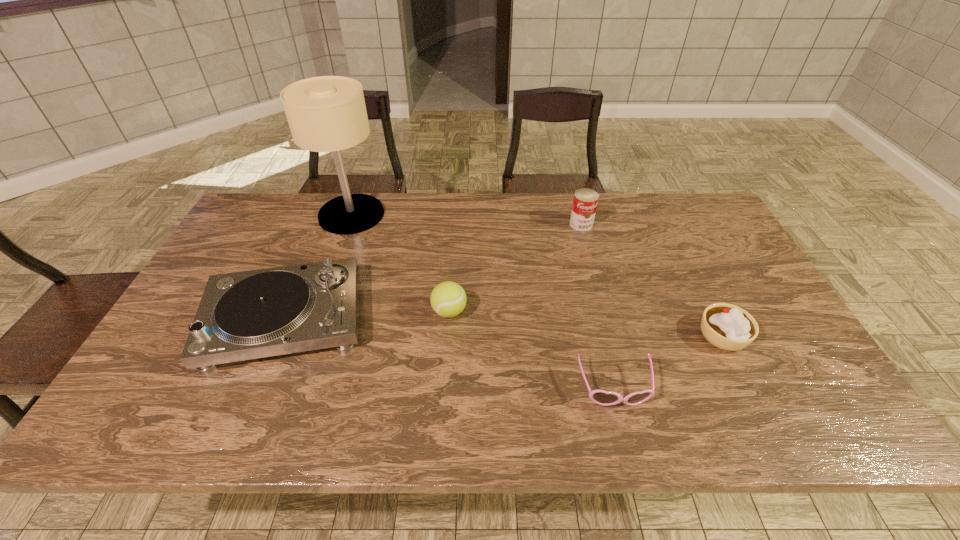
Locate an element on the screen. The image size is (960, 540). free space located on the front of the rightmost object is located at coordinates (756, 400).

Locate an element on the screen. This screenshot has width=960, height=540. table lamp that is at the far edge is located at coordinates tap(326, 113).

At what (x,y) coordinates should I click in order to perform the action: click on can that is positioned at the far edge. Please return your answer as a coordinate pair (x, y). Looking at the image, I should click on (585, 201).

Where is `object located in the near edge section of the desktop`? The image size is (960, 540). object located in the near edge section of the desktop is located at coordinates (601, 397).

Find the location of `object at the left edge`. object at the left edge is located at coordinates (253, 314).

Find the location of a particular element. object positioned at the right edge is located at coordinates (726, 326).

The width and height of the screenshot is (960, 540). In the image, there is a desktop. Find the location of `vacant space at the far edge`. vacant space at the far edge is located at coordinates (599, 206).

This screenshot has width=960, height=540. In the image, there is a desktop. Find the location of `free region at the near edge`. free region at the near edge is located at coordinates (451, 410).

This screenshot has height=540, width=960. In the image, there is a desktop. Identify the location of vacant area at the left edge. (236, 238).

Identify the location of vacant space at the right edge. The height and width of the screenshot is (540, 960). (758, 288).